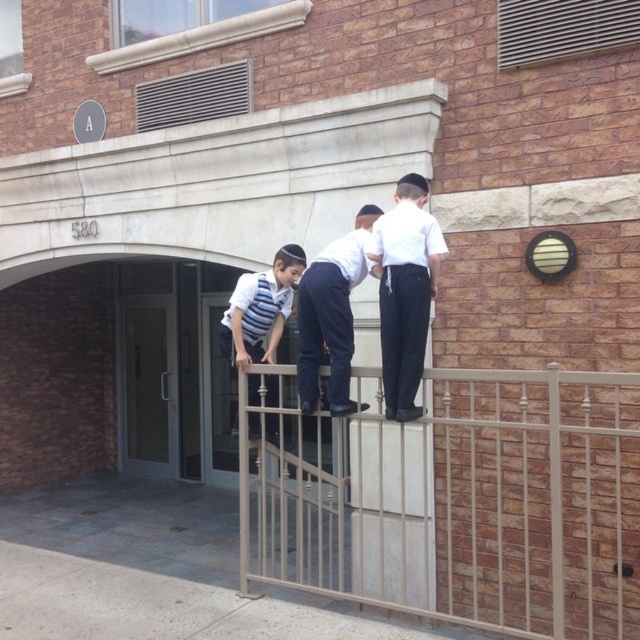
You are a safety inspector assessing the scene. You notice the tan wrought iron fence at upper center and the white matte uniform at center. According to safety standards, the fence must be at least 1.2 meters tall to prevent falls. Can you determine if the fence meets this requirement based on their positions?

The tan wrought iron fence at upper center is taller than the white matte uniform at center. Since the boys wearing the white matte uniform at center are likely over 1.2 meters tall, the fence probably meets the required height.

You are a safety inspector assessing the scene. The striped fabric shirt at upper center belongs to one of the boys standing on the metal railing. The translucent glass door at center is part of the building entrance. Based on their positions, which object is closer to you as the inspector?

The striped fabric shirt at upper center is closer to you than the translucent glass door at center because the description states that the translucent glass door at center is further to the viewer than the striped fabric shirt at upper center.